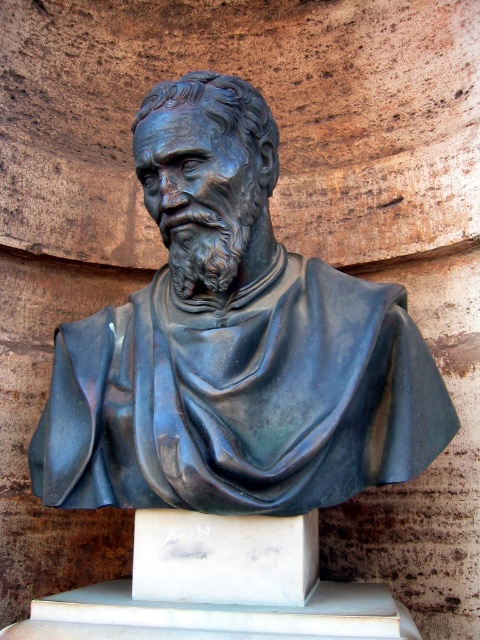
You are an art conservator tasked with moving the bronze statue at center and the white marble pedestal at center to a new exhibition space. The doorway you need to pass through is 70 centimeters wide. Can both items fit through the doorway side by side without rotating them?

The bronze statue at center and white marble pedestal at center are 69.18 centimeters apart from each other. Since the total width required would be their combined width, but the description only provides the distance between them, not their individual widths. Therefore, it is impossible to determine if they can fit through the 70 cm doorway without additional information about their individual dimensions.

You are an art conservator assessing the stability of the bronze statue at center and the white marble pedestal at center. Based on their sizes, which object might require a more secure anchoring system to prevent tipping?

The bronze statue at center is larger in size than the white marble pedestal at center, so the statue might require a more secure anchoring system to prevent tipping due to its greater size and potential weight distribution.

You are an art conservator assessing the space needed to transport the bronze statue at center and the white marble pedestal at center. Based on their dimensions, can the statue be placed on top of the pedestal without overhanging the edges?

The bronze statue at center might be wider than the white marble pedestal at center, so there is a possibility that placing the statue on top could cause it to overhang the edges of the pedestal.